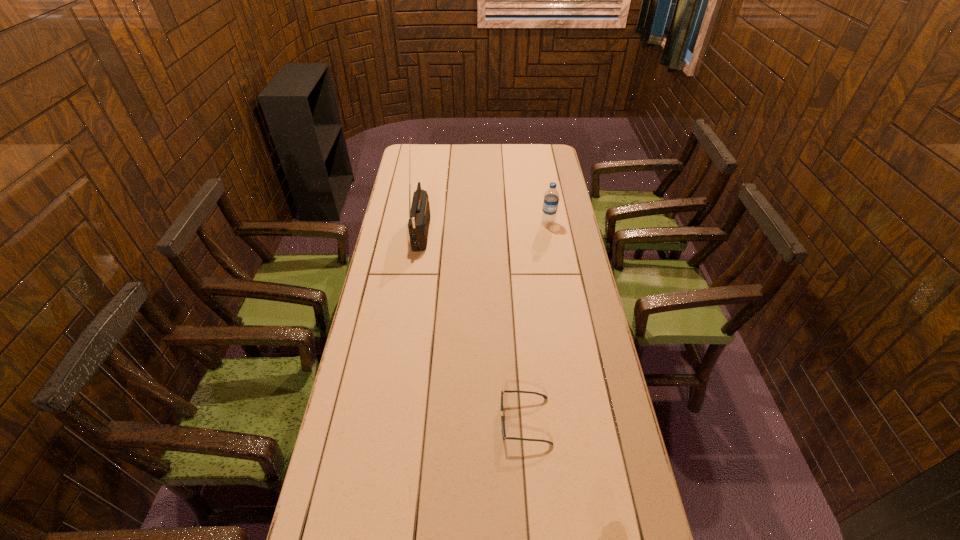
Identify the location of radio receiver. The image size is (960, 540). (419, 216).

Where is `the leftmost object`? the leftmost object is located at coordinates (419, 216).

What are the coordinates of `the rightmost object` in the screenshot? It's located at (551, 198).

The height and width of the screenshot is (540, 960). I want to click on the second tallest object, so click(x=551, y=198).

This screenshot has height=540, width=960. What are the coordinates of `spectacles` in the screenshot? It's located at (506, 391).

I want to click on the nearest object, so click(x=506, y=391).

At what (x,y) coordinates should I click in order to perform the action: click on free location located on the front-facing side of the leftmost object. Please return your answer as a coordinate pair (x, y). Looking at the image, I should click on (480, 230).

I want to click on vacant space located on the label of the second shortest object, so click(557, 274).

The image size is (960, 540). In order to click on vacant position located 0.290m on the face of the spectacles in this screenshot , I will do `click(396, 421)`.

Locate an element on the screen. The width and height of the screenshot is (960, 540). blank space located 0.370m on the face of the spectacles is located at coordinates (368, 421).